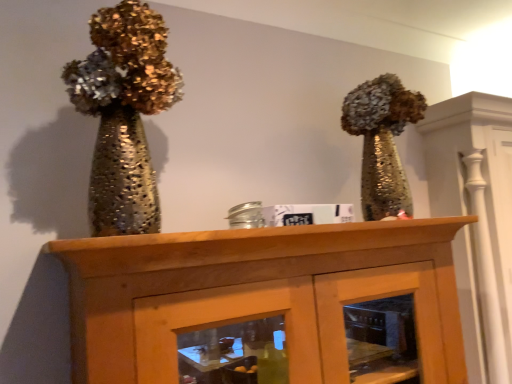
Question: Can we say wooden cabinet at center lies outside shiny metallic vase at left?

Choices:
 (A) no
 (B) yes

Answer: (B)

Question: Considering the relative sizes of wooden cabinet at center and shiny metallic vase at left in the image provided, is wooden cabinet at center shorter than shiny metallic vase at left?

Choices:
 (A) yes
 (B) no

Answer: (B)

Question: Does wooden cabinet at center have a greater width compared to shiny metallic vase at left?

Choices:
 (A) no
 (B) yes

Answer: (B)

Question: Considering the relative positions of wooden cabinet at center and shiny metallic vase at left in the image provided, is wooden cabinet at center to the right of shiny metallic vase at left from the viewer's perspective?

Choices:
 (A) yes
 (B) no

Answer: (A)

Question: Could you tell me if wooden cabinet at center is turned towards shiny metallic vase at left?

Choices:
 (A) yes
 (B) no

Answer: (B)

Question: From the image's perspective, is wooden cabinet at center below shiny metallic vase at left?

Choices:
 (A) no
 (B) yes

Answer: (B)

Question: From a real-world perspective, is shiny metallic vase at left beneath wooden cabinet at center?

Choices:
 (A) no
 (B) yes

Answer: (A)

Question: Considering the relative positions of shiny metallic vase at left and wooden cabinet at center in the image provided, is shiny metallic vase at left behind wooden cabinet at center?

Choices:
 (A) no
 (B) yes

Answer: (B)

Question: From the image's perspective, is shiny metallic vase at left under wooden cabinet at center?

Choices:
 (A) yes
 (B) no

Answer: (B)

Question: Would you say shiny metallic vase at left contains wooden cabinet at center?

Choices:
 (A) no
 (B) yes

Answer: (A)

Question: Is shiny metallic vase at left bigger than wooden cabinet at center?

Choices:
 (A) yes
 (B) no

Answer: (B)

Question: From the image's perspective, is shiny metallic vase at left on top of wooden cabinet at center?

Choices:
 (A) yes
 (B) no

Answer: (A)

Question: Is point (125, 91) closer or farther from the camera than point (203, 312)?

Choices:
 (A) farther
 (B) closer

Answer: (A)